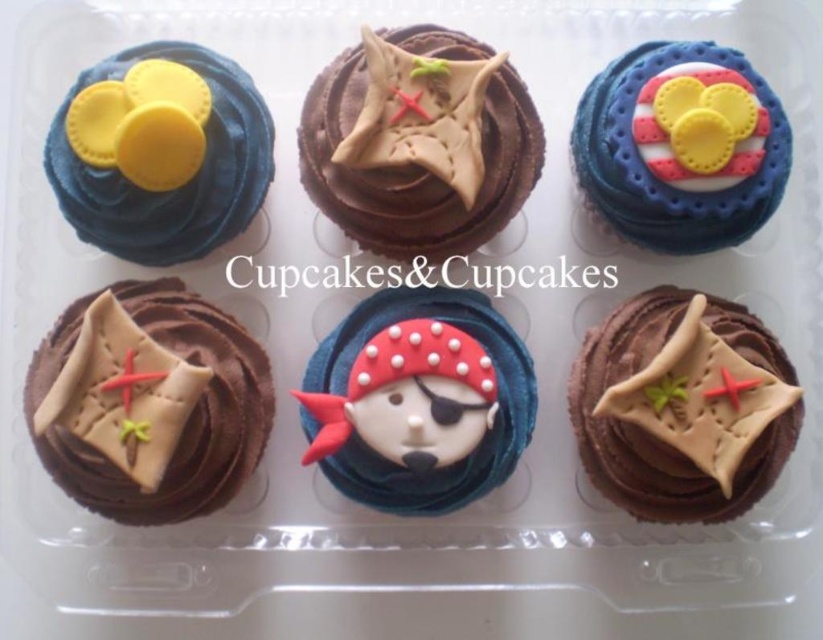
You are looking at the tray of cupcakes. There are two points marked on the cupcakes. The first point is at coordinates point (x=440, y=326) and the second point is at point (x=747, y=230). Which point is closer to you?

The point at coordinates point (x=440, y=326) is closer to the viewer than point (x=747, y=230).

You are a pirate looking for the tallest treasure. You see a chocolate matte paper at center and a matte blue frosting at upper left. Which one should you choose?

The chocolate matte paper at center is much taller than the matte blue frosting at upper left, so you should choose the chocolate matte paper at center.

What is located at the coordinates point [147,403]?

At point [147,403] lies chocolate matte paper at center.